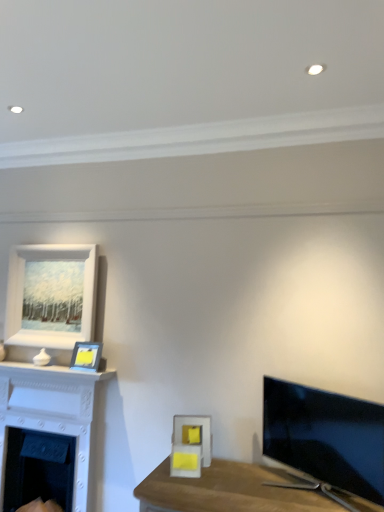
Question: From a real-world perspective, is matte yellow picture frame at upper left, the second picture frame from the right, beneath white glossy fireplace at left, the second fireplace when ordered from bottom to top?

Choices:
 (A) yes
 (B) no

Answer: (B)

Question: Can you confirm if matte yellow picture frame at upper left, arranged as the second picture frame when ordered from the bottom, is positioned to the right of white glossy fireplace at left, placed as the 1th fireplace when sorted from top to bottom?

Choices:
 (A) yes
 (B) no

Answer: (A)

Question: Can you confirm if matte yellow picture frame at upper left, the second picture frame from the back, is shorter than white glossy fireplace at left, placed as the 1th fireplace when sorted from top to bottom?

Choices:
 (A) no
 (B) yes

Answer: (B)

Question: Considering the relative sizes of matte yellow picture frame at upper left, arranged as the second picture frame when ordered from the bottom, and white glossy fireplace at left, the second fireplace when ordered from bottom to top, in the image provided, is matte yellow picture frame at upper left, arranged as the second picture frame when ordered from the bottom, smaller than white glossy fireplace at left, the second fireplace when ordered from bottom to top,?

Choices:
 (A) yes
 (B) no

Answer: (A)

Question: Does matte yellow picture frame at upper left, arranged as the second picture frame when viewed from the top, come behind white glossy fireplace at left, the second fireplace when ordered from bottom to top?

Choices:
 (A) yes
 (B) no

Answer: (A)

Question: Does matte yellow picture frame at upper left, the second picture frame from the right, have a larger size compared to white glossy fireplace at left, the second fireplace when ordered from bottom to top?

Choices:
 (A) no
 (B) yes

Answer: (A)

Question: Can you see white matte fireplace at lower left, placed as the second fireplace when sorted from top to bottom, touching matte yellow picture frame at upper left, arranged as the second picture frame when ordered from the bottom?

Choices:
 (A) no
 (B) yes

Answer: (A)

Question: Is white matte fireplace at lower left, the first fireplace from the bottom, shorter than matte yellow picture frame at upper left, the second picture frame viewed from the left?

Choices:
 (A) no
 (B) yes

Answer: (A)

Question: Is white matte fireplace at lower left, placed as the second fireplace when sorted from top to bottom, completely or partially outside of matte yellow picture frame at upper left, which is the 2th picture frame in front-to-back order?

Choices:
 (A) yes
 (B) no

Answer: (A)

Question: Does white matte fireplace at lower left, the first fireplace from the bottom, have a smaller size compared to matte yellow picture frame at upper left, the second picture frame viewed from the left?

Choices:
 (A) no
 (B) yes

Answer: (A)

Question: Is white matte fireplace at lower left, the first fireplace from the bottom, closer to camera compared to matte yellow picture frame at upper left, arranged as the second picture frame when viewed from the top?

Choices:
 (A) yes
 (B) no

Answer: (A)

Question: Is white matte fireplace at lower left, placed as the second fireplace when sorted from top to bottom, oriented towards matte yellow picture frame at upper left, which is the 2th picture frame in front-to-back order?

Choices:
 (A) no
 (B) yes

Answer: (A)

Question: Is white matte picture frame at upper left, the first picture frame from the left, far from white matte fireplace at lower left, placed as the second fireplace when sorted from top to bottom?

Choices:
 (A) yes
 (B) no

Answer: (B)